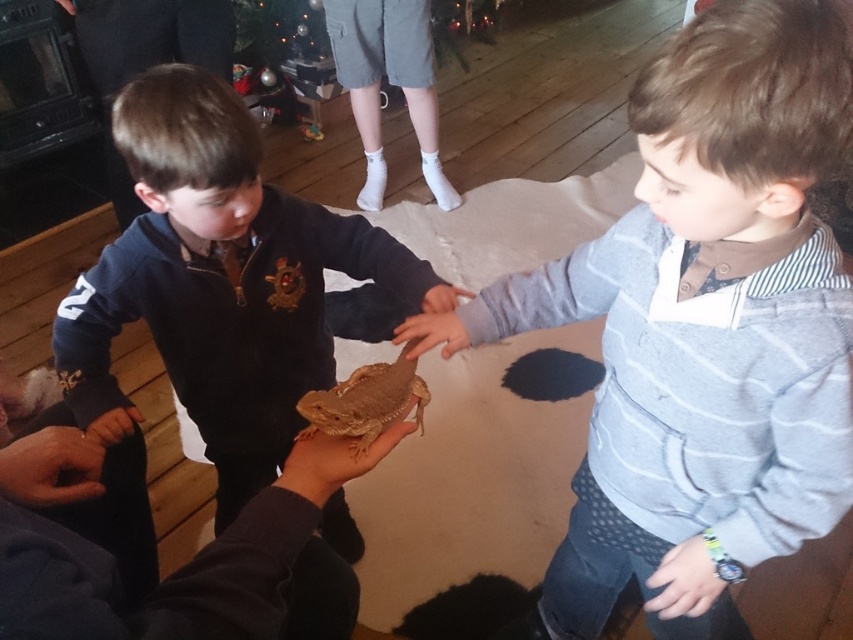
Describe the element at coordinates (706, 326) in the screenshot. The width and height of the screenshot is (853, 640). I see `matte brown sweater at center` at that location.

Which is more to the left, matte brown sweater at center or smooth brown hand at center?

Positioned to the left is smooth brown hand at center.

Who is more forward, (618,573) or (456,323)?

Point (456,323) is in front.

Find the location of a particular element. The width and height of the screenshot is (853, 640). matte brown sweater at center is located at coordinates click(x=706, y=326).

Who is positioned more to the left, brown scaly lizard at center or smooth brown hand at center?

brown scaly lizard at center

Looking at this image, does brown scaly lizard at center have a lesser height compared to smooth brown hand at center?

No.

Between point (97, 330) and point (436, 320), which one is positioned in front?

Point (436, 320) is in front.

The image size is (853, 640). Identify the location of brown scaly lizard at center. (219, 282).

Does matte brown sweater at center have a greater width compared to brown scaly lizard at center?

In fact, matte brown sweater at center might be narrower than brown scaly lizard at center.

Is point (721, 433) less distant than point (210, 138)?

Yes, point (721, 433) is in front of point (210, 138).

What are the coordinates of `matte brown sweater at center` in the screenshot? It's located at (706, 326).